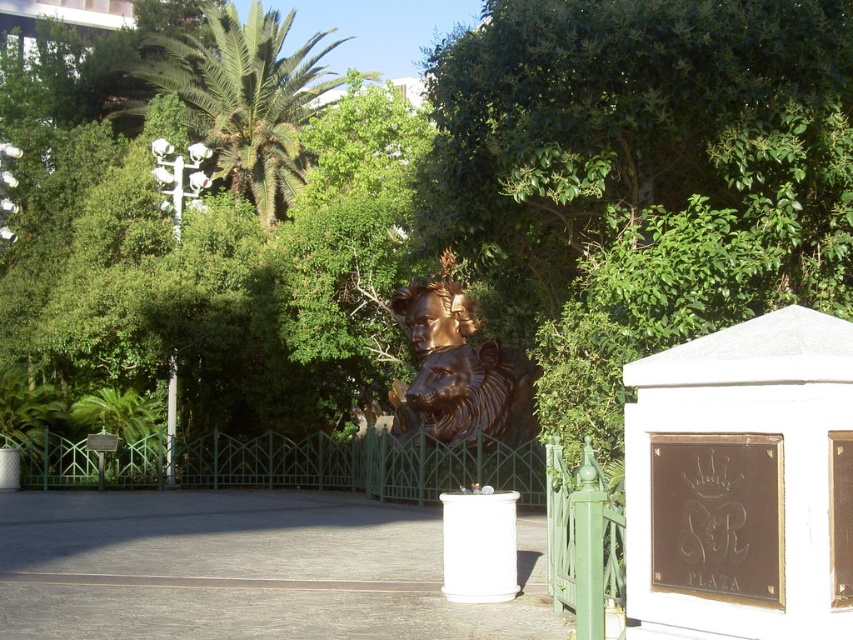
You are a maintenance worker needing to reach both the green metal fence at center and the green leafy palm tree at upper left. Which object is nearer to you as you stand at the entrance of the park?

The green metal fence at center is closer to the viewer than the green leafy palm tree at upper left, so you would reach the green metal fence at center first.

You are standing in the park and see two points marked in the image. Which point, point (x=276, y=436) or point (x=231, y=74), is closer to you?

Point (x=276, y=436) is closer to you than point (x=231, y=74).